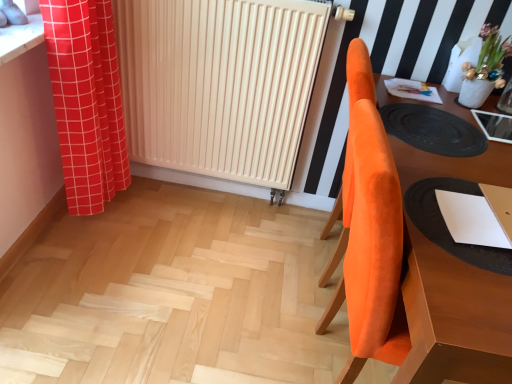
Question: Considering the relative sizes of red checkered curtain at left and black rubber mat at right in the image provided, is red checkered curtain at left smaller than black rubber mat at right?

Choices:
 (A) no
 (B) yes

Answer: (A)

Question: Is red checkered curtain at left beside black rubber mat at right?

Choices:
 (A) no
 (B) yes

Answer: (A)

Question: Is red checkered curtain at left completely or partially outside of black rubber mat at right?

Choices:
 (A) yes
 (B) no

Answer: (A)

Question: Can you confirm if red checkered curtain at left is positioned to the right of black rubber mat at right?

Choices:
 (A) yes
 (B) no

Answer: (B)

Question: From the image's perspective, is red checkered curtain at left above black rubber mat at right?

Choices:
 (A) yes
 (B) no

Answer: (A)

Question: Does red checkered curtain at left contain black rubber mat at right?

Choices:
 (A) no
 (B) yes

Answer: (A)

Question: Is orange velvet chair at right wider than white matte radiator at center?

Choices:
 (A) yes
 (B) no

Answer: (A)

Question: From a real-world perspective, is orange velvet chair at right under white matte radiator at center?

Choices:
 (A) yes
 (B) no

Answer: (A)

Question: Is orange velvet chair at right looking in the opposite direction of white matte radiator at center?

Choices:
 (A) yes
 (B) no

Answer: (B)

Question: Can you confirm if orange velvet chair at right is positioned to the right of white matte radiator at center?

Choices:
 (A) yes
 (B) no

Answer: (A)

Question: Would you say orange velvet chair at right is a long distance from white matte radiator at center?

Choices:
 (A) no
 (B) yes

Answer: (A)

Question: Is the position of orange velvet chair at right less distant than that of white matte radiator at center?

Choices:
 (A) yes
 (B) no

Answer: (A)

Question: Is white matte radiator at center oriented towards red checkered curtain at left?

Choices:
 (A) yes
 (B) no

Answer: (A)